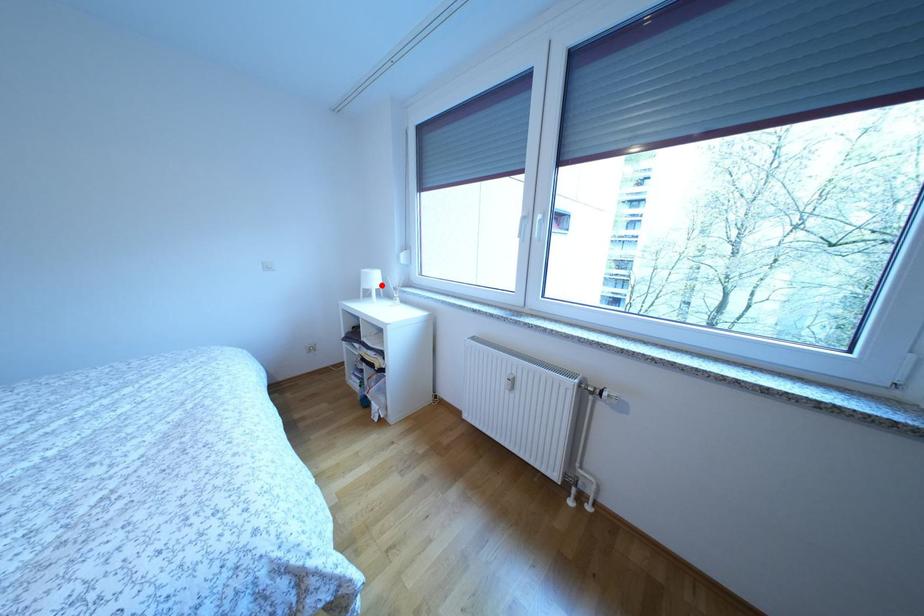
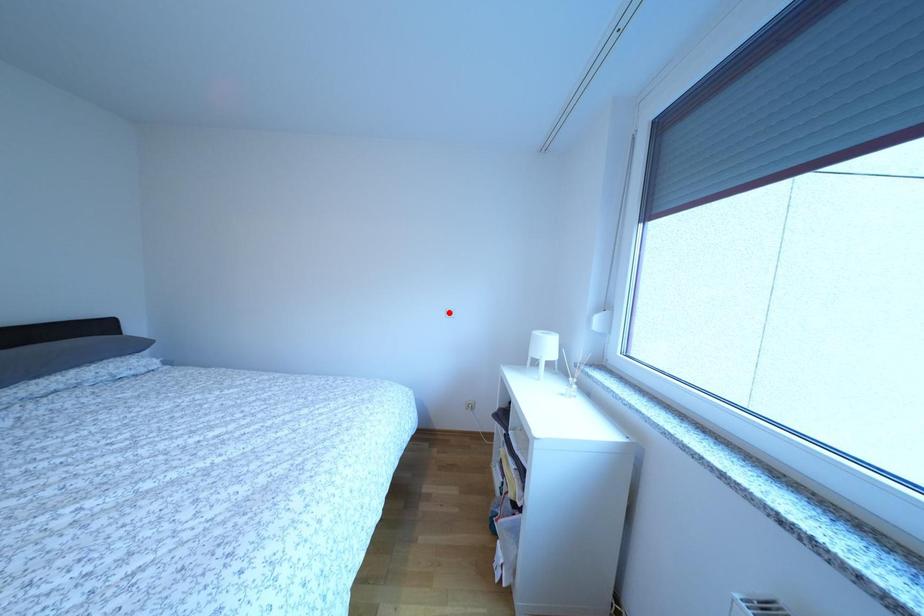
I am providing you with two images of the same scene from different viewpoints. A red point is marked on the first image and another point is marked on the second image. Are the points marked in image1 and image2 representing the same 3D position?

No